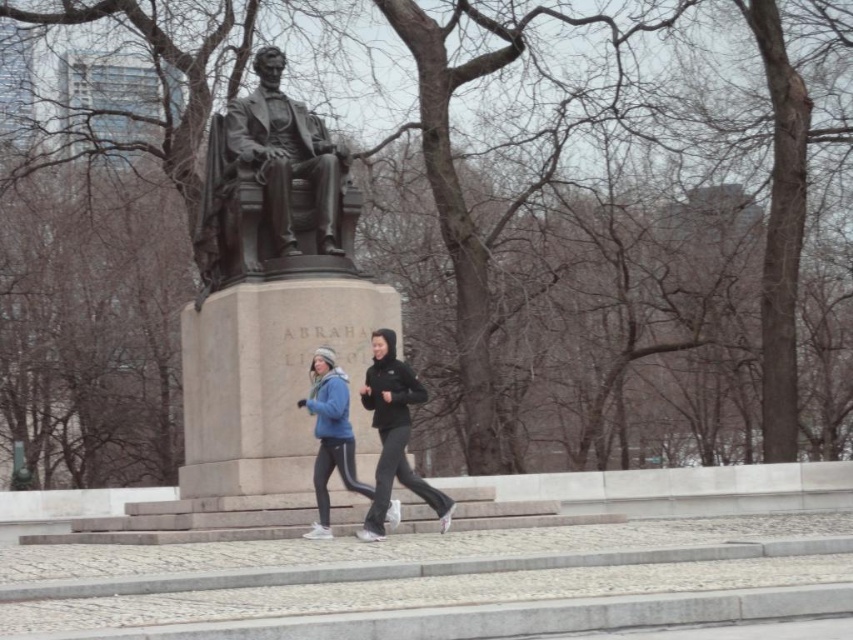
Question: Does bronze statue at center appear on the right side of matte blue jacket at center?

Choices:
 (A) yes
 (B) no

Answer: (B)

Question: Which point appears farthest from the camera in this image?

Choices:
 (A) (241, 129)
 (B) (321, 532)

Answer: (A)

Question: Which object is closer to the camera taking this photo?

Choices:
 (A) matte blue jacket at center
 (B) bronze statue at center

Answer: (A)

Question: From the image, what is the correct spatial relationship of bronze statue at center in relation to matte blue jacket at center?

Choices:
 (A) below
 (B) above

Answer: (B)

Question: Considering the relative positions of bronze statue at center and matte blue jacket at center in the image provided, where is bronze statue at center located with respect to matte blue jacket at center?

Choices:
 (A) right
 (B) left

Answer: (B)